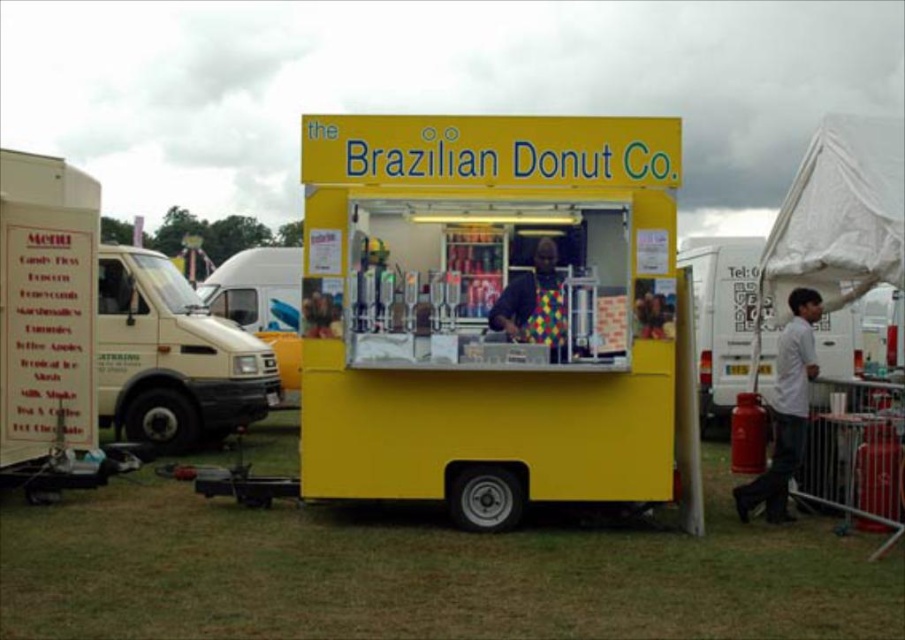
Between yellow matte food truck at center and green grass at lower center, which one has more height?

Standing taller between the two is yellow matte food truck at center.

How much distance is there between yellow matte food truck at center and green grass at lower center?

The distance of yellow matte food truck at center from green grass at lower center is 9.61 feet.

Where is `yellow matte food truck at center`? This screenshot has height=640, width=905. yellow matte food truck at center is located at coordinates (494, 317).

Identify the location of yellow matte food truck at center. (494, 317).

Is point (822, 576) positioned after point (780, 387)?

No, it is not.

The image size is (905, 640). I want to click on green grass at lower center, so click(x=424, y=572).

The width and height of the screenshot is (905, 640). I want to click on green grass at lower center, so click(x=424, y=572).

Does yellow matte food truck at center appear on the right side of white cotton shirt at right?

No, yellow matte food truck at center is not to the right of white cotton shirt at right.

Consider the image. Does yellow matte food truck at center have a larger size compared to white cotton shirt at right?

Correct, yellow matte food truck at center is larger in size than white cotton shirt at right.

This screenshot has width=905, height=640. What do you see at coordinates (494, 317) in the screenshot?
I see `yellow matte food truck at center` at bounding box center [494, 317].

Where is `yellow matte food truck at center`? Image resolution: width=905 pixels, height=640 pixels. yellow matte food truck at center is located at coordinates (494, 317).